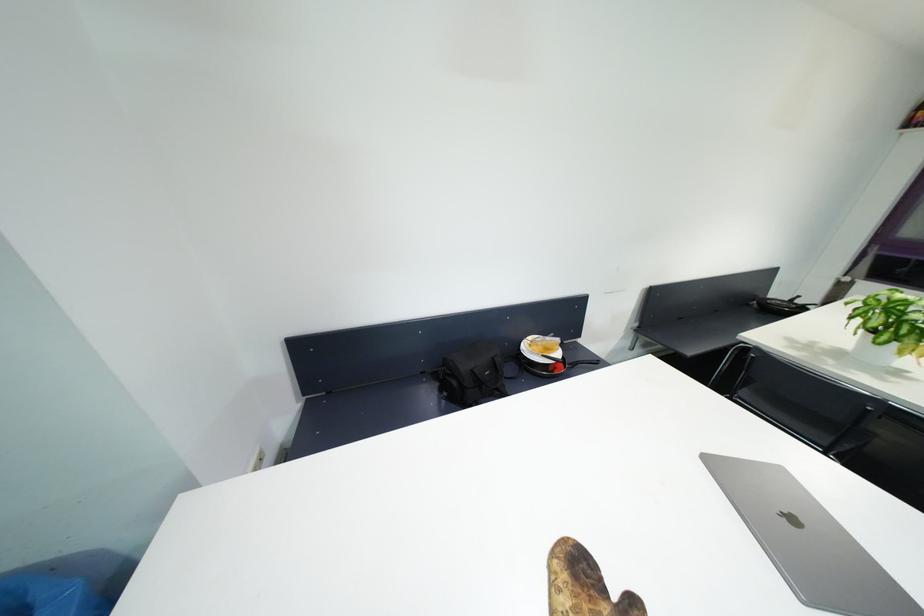
The location [582,585] corresponds to which object?

It corresponds to the patterned oven mitt in the image.